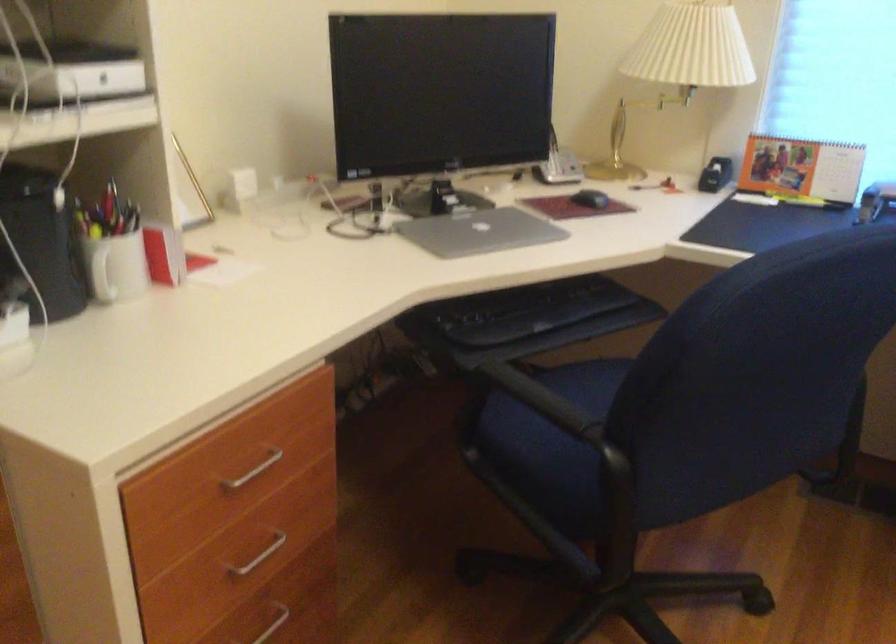
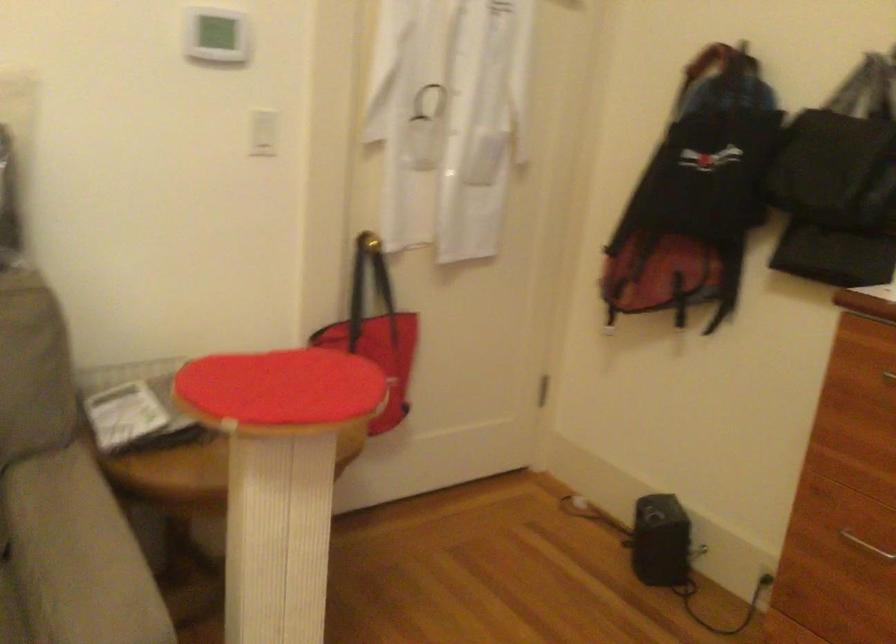
Based on the continuous images, in which direction is the camera rotating?

The rotation direction of the camera is left-down.